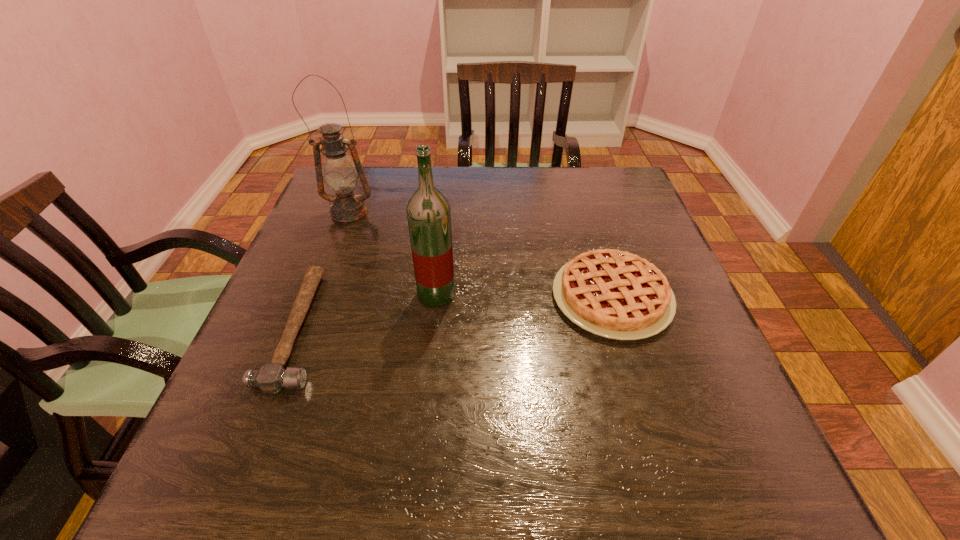
This screenshot has height=540, width=960. I want to click on oil lamp that is at the left edge, so click(340, 175).

The height and width of the screenshot is (540, 960). Identify the location of hammer present at the left edge. (271, 378).

Identify the location of object that is positioned at the right edge. (615, 294).

Identify the location of object that is at the far left corner. (340, 175).

In the image, there is a desktop. Where is `blank space at the far edge`? This screenshot has height=540, width=960. blank space at the far edge is located at coordinates (500, 212).

Locate an element on the screen. Image resolution: width=960 pixels, height=540 pixels. vacant region at the left edge of the desktop is located at coordinates (239, 433).

Find the location of a particular element. The height and width of the screenshot is (540, 960). vacant space at the right edge is located at coordinates pyautogui.click(x=634, y=217).

The width and height of the screenshot is (960, 540). In the image, there is a desktop. In order to click on vacant space at the near right corner in this screenshot , I will do `click(748, 481)`.

Image resolution: width=960 pixels, height=540 pixels. Find the location of `blank region between the third object from left to right and the second shortest object`. blank region between the third object from left to right and the second shortest object is located at coordinates (524, 296).

Locate an element on the screen. This screenshot has height=540, width=960. free spot between the shortest object and the oil lamp is located at coordinates (324, 270).